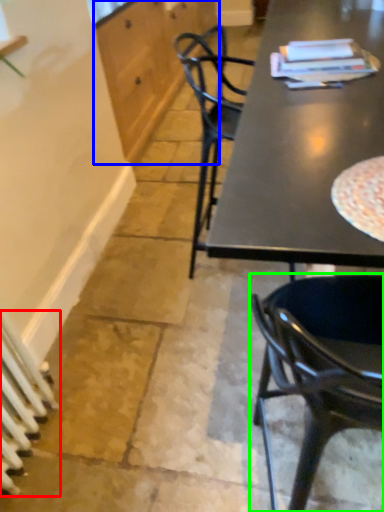
Question: Which object is positioned closest to radiator (highlighted by a red box)? Select from cabinetry (highlighted by a blue box) and chair (highlighted by a green box).

Choices:
 (A) cabinetry
 (B) chair

Answer: (B)